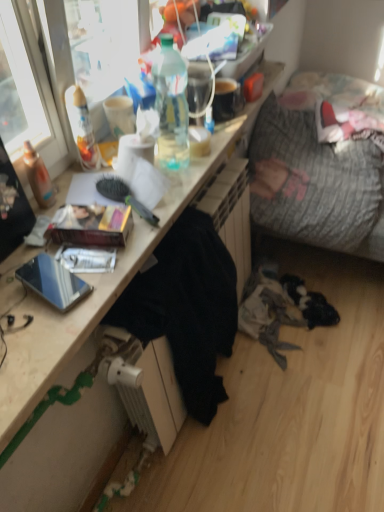
The height and width of the screenshot is (512, 384). Find the location of `unoccupied area in front of matte cardboard book at center`. unoccupied area in front of matte cardboard book at center is located at coordinates (77, 283).